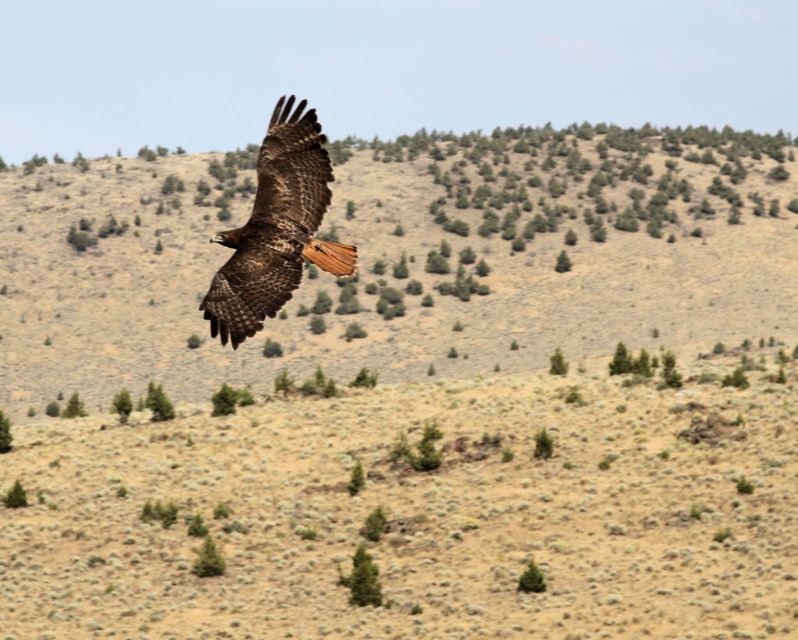
Is brown feathered eagle at center to the right of green leafy tree at lower left from the viewer's perspective?

Correct, you'll find brown feathered eagle at center to the right of green leafy tree at lower left.

Does point (346, 273) come farther from viewer compared to point (124, 420)?

No, (346, 273) is closer to viewer.

Identify the location of brown feathered eagle at center. This screenshot has height=640, width=798. (275, 228).

Which of these two, brown feathered eagle at center or green textured tree at lower center, stands taller?

brown feathered eagle at center is taller.

Does brown feathered eagle at center appear over green textured tree at lower center?

Yes.

Find the location of a particular element. The width and height of the screenshot is (798, 640). brown feathered eagle at center is located at coordinates (275, 228).

In the scene shown: Is green textured tree at lower center thinner than green leafy tree at lower left?

Indeed, green textured tree at lower center has a lesser width compared to green leafy tree at lower left.

Who is more distant from viewer, (377, 580) or (117, 408)?

Point (117, 408)

Image resolution: width=798 pixels, height=640 pixels. What do you see at coordinates (362, 579) in the screenshot?
I see `green textured tree at lower center` at bounding box center [362, 579].

The height and width of the screenshot is (640, 798). I want to click on green textured tree at lower center, so click(362, 579).